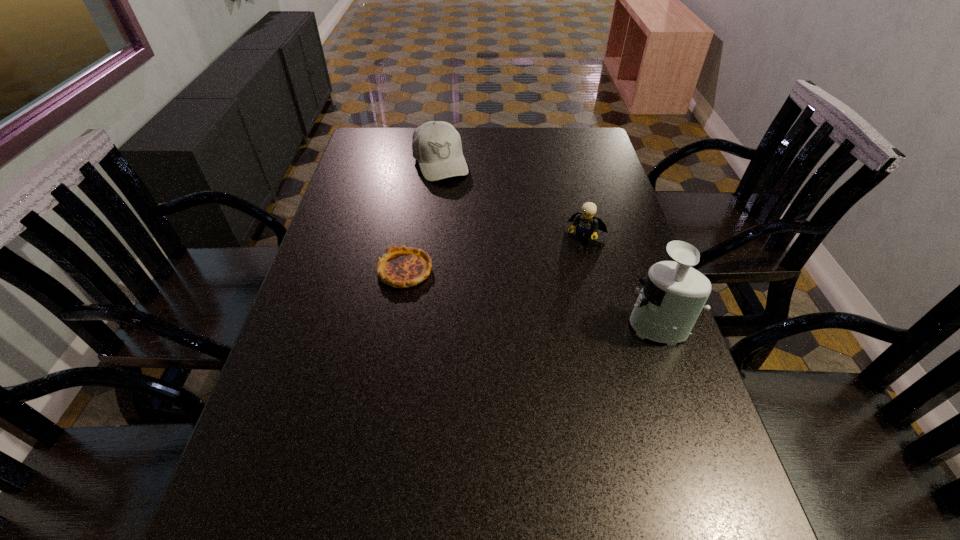
This screenshot has width=960, height=540. I want to click on free space between the baseball cap and the shortest object, so click(x=422, y=216).

The width and height of the screenshot is (960, 540). In order to click on free area in between the shortest object and the Lego in this screenshot , I will do `click(495, 253)`.

Find the location of a particular element. The width and height of the screenshot is (960, 540). empty space that is in between the tallest object and the third nearest object is located at coordinates (620, 280).

At what (x,y) coordinates should I click in order to perform the action: click on object that is the third closest to the shortest object. Please return your answer as a coordinate pair (x, y). This screenshot has height=540, width=960. Looking at the image, I should click on (674, 294).

Select which object appears as the third closest to the farthest object. Please provide its 2D coordinates. Your answer should be formatted as a tuple, i.e. [(x, y)], where the tuple contains the x and y coordinates of a point satisfying the conditions above.

[(674, 294)]

Where is `free space in the image that satisfies the following two spatial constraints: 1. on the front side of the juicer; 2. on the left side of the second farthest object`? The image size is (960, 540). free space in the image that satisfies the following two spatial constraints: 1. on the front side of the juicer; 2. on the left side of the second farthest object is located at coordinates (609, 325).